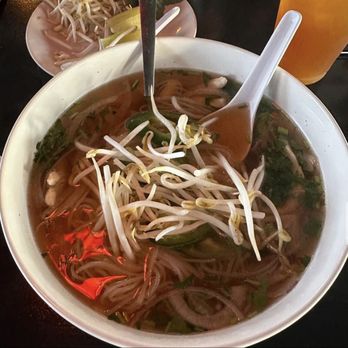
The image size is (348, 348). In order to click on bowl in this screenshot , I will do `click(313, 117)`, `click(209, 57)`.